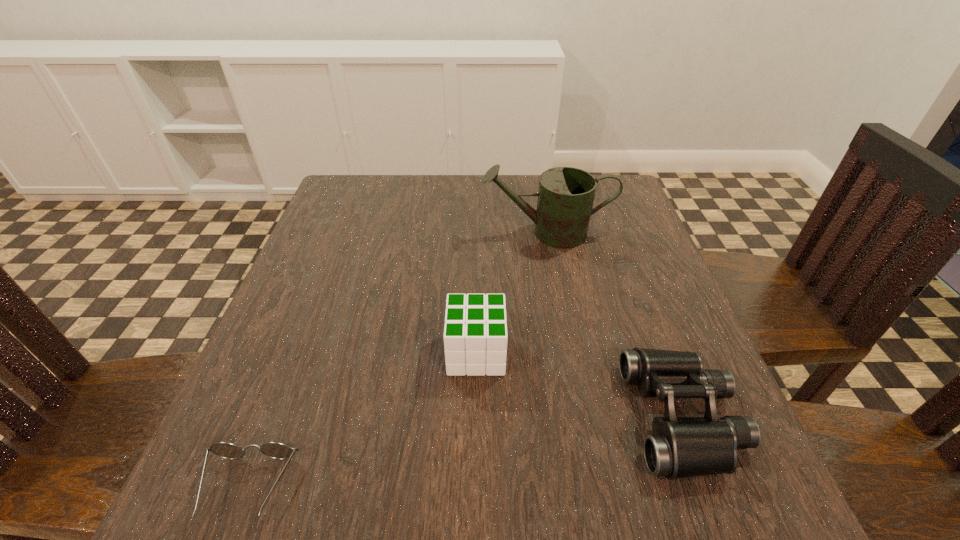
This screenshot has width=960, height=540. Identify the location of vacant region located on the front-facing side of the third tallest object. (476, 417).

Locate an element on the screen. The height and width of the screenshot is (540, 960). free space located 0.120m on the front-facing side of the third tallest object is located at coordinates point(554,417).

At what (x,y) coordinates should I click in order to perform the action: click on blank space located on the front-facing side of the third tallest object. Please return your answer as a coordinate pair (x, y). The height and width of the screenshot is (540, 960). Looking at the image, I should click on [599, 417].

At what (x,y) coordinates should I click in order to perform the action: click on object situated at the far edge. Please return your answer as a coordinate pair (x, y). Looking at the image, I should click on (566, 195).

What are the coordinates of `binoculars that is positioned at the near edge` in the screenshot? It's located at (680, 447).

At what (x,y) coordinates should I click in order to perform the action: click on spectacles situated at the near edge. Please return your answer as a coordinate pair (x, y). Image resolution: width=960 pixels, height=540 pixels. Looking at the image, I should click on (276, 450).

This screenshot has width=960, height=540. Find the location of `object at the left edge`. object at the left edge is located at coordinates [x=276, y=450].

In order to click on watering can positioned at the right edge in this screenshot , I will do `click(566, 195)`.

This screenshot has width=960, height=540. Identify the location of binoculars that is at the right edge. (680, 447).

Where is `object located in the near left corner section of the desktop`? The width and height of the screenshot is (960, 540). object located in the near left corner section of the desktop is located at coordinates (276, 450).